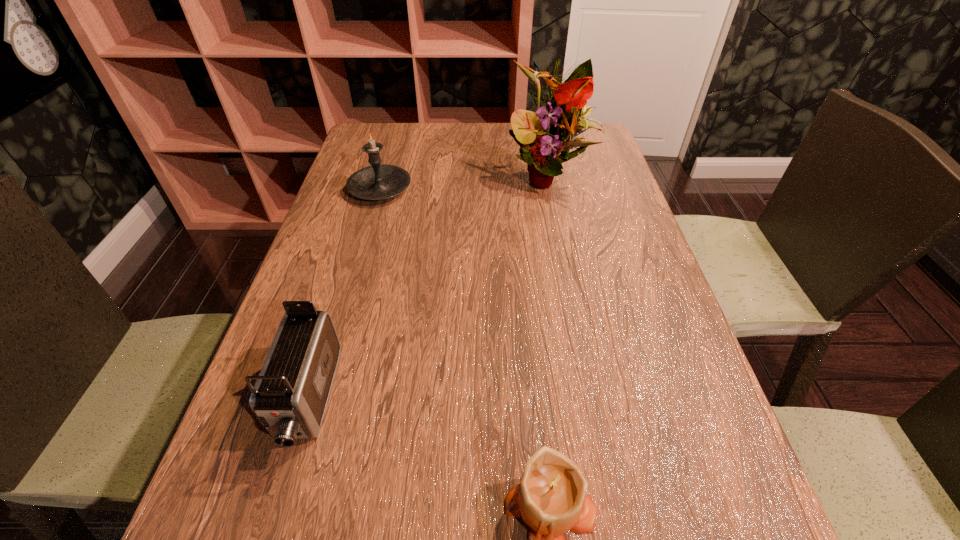
Identify which object is the second nearest to the camcorder. Please provide its 2D coordinates. Your answer should be formatted as a tuple, i.e. [(x, y)], where the tuple contains the x and y coordinates of a point satisfying the conditions above.

[(376, 182)]

Find the location of a particular element. This screenshot has width=960, height=540. object identified as the second closest to the nearest object is located at coordinates (541, 140).